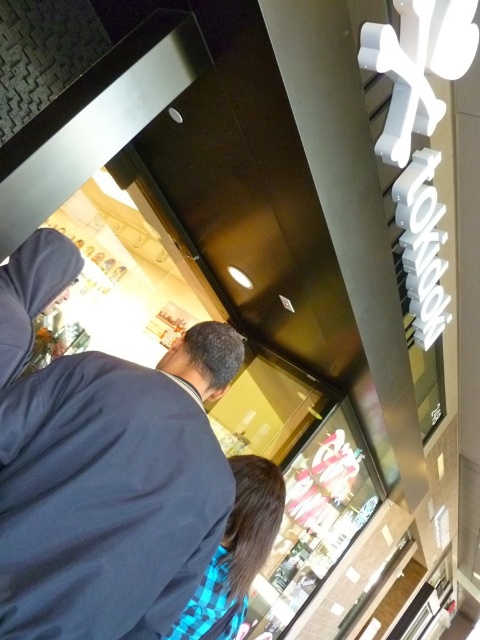
You are a delivery person trying to hand over a package to the recipient standing at the center of the scene. The recipient is wearing the dark blue fabric at center and the blue plaid shirt at lower center. To ensure you can reach them without moving, what is the minimum distance your arm must extend?

The dark blue fabric at center and blue plaid shirt at lower center are 21.06 inches apart. Therefore, your arm must extend at least 21.06 inches to reach the recipient.

Please look at the image and locate the point at coordinates (111, 490). What object is located at that exact point?

The point at coordinates (111, 490) marks the dark blue fabric at center.

You are standing inside the building and looking through the storefront window. You notice two items in the scene. The first is the dark blue fabric at center, and the second is the blue plaid shirt at lower center. Which of these two items appears taller in the image?

The dark blue fabric at center appears much taller than the blue plaid shirt at lower center in the image.